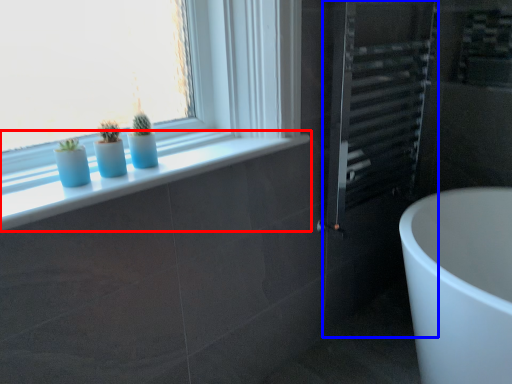
Question: Which object appears closest to the camera in this image, window sill (highlighted by a red box) or screen door (highlighted by a blue box)?

Choices:
 (A) window sill
 (B) screen door

Answer: (A)